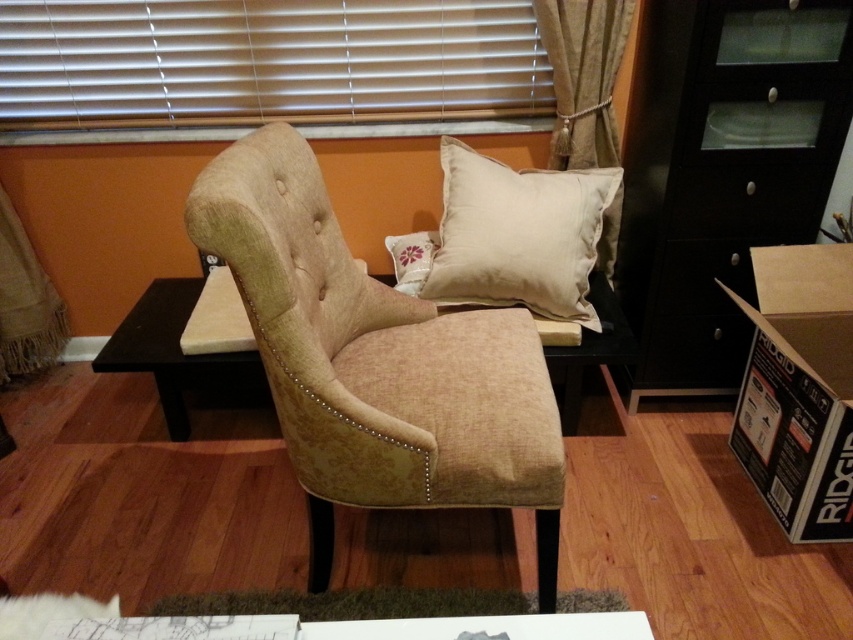
Is beige fabric pillow at upper center shorter than burlap curtain at lower left?

Yes.

Can you confirm if beige fabric pillow at upper center is positioned above burlap curtain at lower left?

Yes, beige fabric pillow at upper center is above burlap curtain at lower left.

Is point (445, 154) more distant than point (44, 346)?

No.

The height and width of the screenshot is (640, 853). Find the location of `beige fabric pillow at upper center`. beige fabric pillow at upper center is located at coordinates (517, 236).

Does white blinds at upper center appear on the right side of matte black drawer at right?

Incorrect, white blinds at upper center is not on the right side of matte black drawer at right.

Can you confirm if white blinds at upper center is bigger than matte black drawer at right?

No, white blinds at upper center is not bigger than matte black drawer at right.

Is point (509, 38) behind point (766, 22)?

Yes, point (509, 38) is farther from viewer.

This screenshot has height=640, width=853. I want to click on white blinds at upper center, so click(265, 61).

Does beige fabric curtain at upper right lie behind burlap curtain at lower left?

No, it is in front of burlap curtain at lower left.

Between point (567, 51) and point (30, 321), which one is positioned behind?

The point (30, 321) is more distant.

Does point (585, 124) come behind point (4, 376)?

No, (585, 124) is closer to viewer.

Locate an element on the screen. The height and width of the screenshot is (640, 853). beige fabric curtain at upper right is located at coordinates (583, 76).